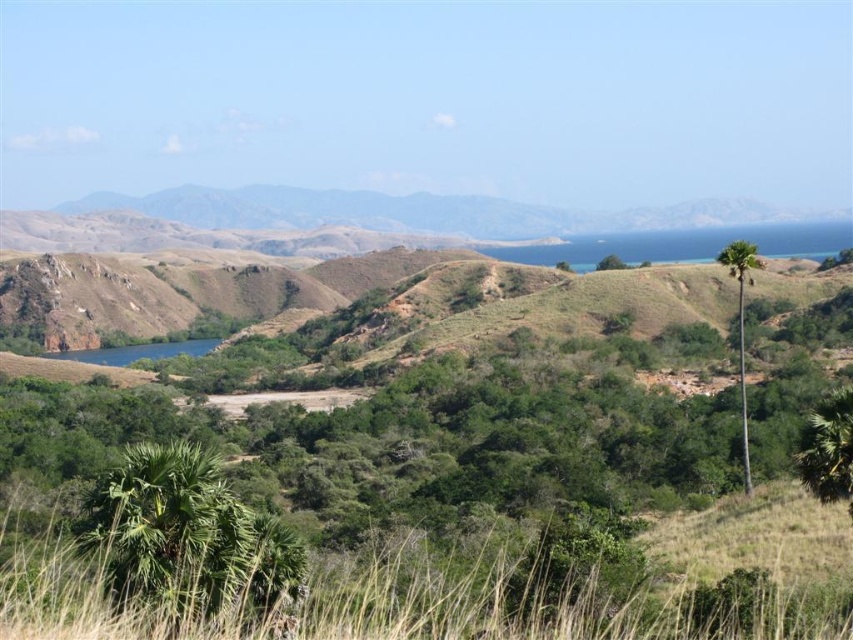
You are a hiker planning to set up a campsite in this area. You need to choose between two spots near the green leafy palm tree at right and the green leafy tree at center. Considering the space they occupy, which tree would allow for a larger campsite area?

The green leafy tree at center occupies more space than the green leafy palm tree at right, so the campsite near the green leafy palm tree at right would allow for a larger area.

You are a hiker planning to cross the area between the green leafy palm tree at right and the green leafy tree at center. Which tree has a wider trunk to rest against while taking a break?

The green leafy palm tree at right has a wider trunk than the green leafy tree at center, so you can rest against it.